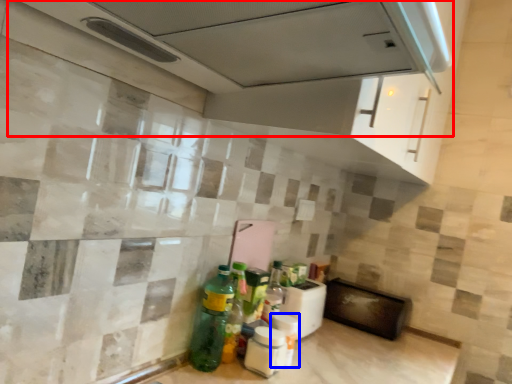
Question: Which point is closer to the camera, exhaust hood (highlighted by a red box) or bottle (highlighted by a blue box)?

Choices:
 (A) exhaust hood
 (B) bottle

Answer: (A)